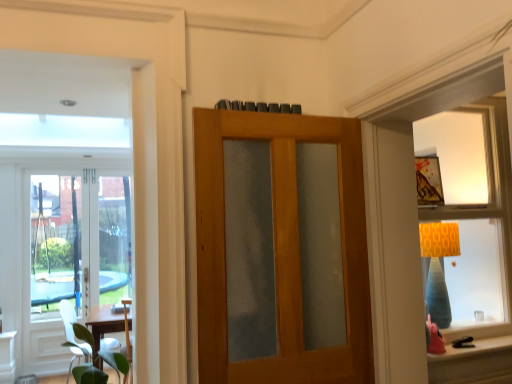
The height and width of the screenshot is (384, 512). I want to click on matte orange lampshade at upper right, so click(x=475, y=213).

Is white matte chair at lower left touching matte orange lampshade at lower right?

white matte chair at lower left and matte orange lampshade at lower right are not in contact.

From the image's perspective, which object appears higher, white matte chair at lower left or matte orange lampshade at lower right?

matte orange lampshade at lower right.

Between white matte chair at lower left and matte orange lampshade at lower right, which one is positioned behind?

Positioned behind is white matte chair at lower left.

Is wooden door with frosted glass at center, the first door viewed from the front, taller or shorter than clear glass door at left, arranged as the second door when viewed from the right?

In the image, wooden door with frosted glass at center, the first door viewed from the front, appears to be shorter than clear glass door at left, arranged as the second door when viewed from the right.

Is wooden door with frosted glass at center, the first door viewed from the front, turned away from clear glass door at left, which ranks as the 2th door in front-to-back order?

Absolutely, wooden door with frosted glass at center, the first door viewed from the front, is directed away from clear glass door at left, which ranks as the 2th door in front-to-back order.

Would you say wooden door with frosted glass at center, the first door viewed from the front, is inside or outside clear glass door at left, arranged as the second door when viewed from the right?

wooden door with frosted glass at center, the first door viewed from the front, cannot be found inside clear glass door at left, arranged as the second door when viewed from the right.

Would you consider wooden door with frosted glass at center, positioned as the 2th door in left-to-right order, to be distant from clear glass door at left, which ranks as the 2th door in front-to-back order?

Yes.

I want to click on chair behind the matte orange lampshade at upper right, so (72, 334).

Is point (65, 313) less distant than point (440, 123)?

No, it is behind (440, 123).

From the image's perspective, which object appears higher, white matte chair at lower left or matte orange lampshade at upper right?

matte orange lampshade at upper right.

Who is taller, matte orange lampshade at lower right or matte orange lampshade at upper right?

matte orange lampshade at upper right.

Which is nearer, (494, 348) or (483, 145)?

Point (494, 348) is positioned closer to the camera compared to point (483, 145).

From a real-world perspective, which is physically above, matte orange lampshade at lower right or matte orange lampshade at upper right?

matte orange lampshade at upper right is physically above.

Considering the sizes of objects matte orange lampshade at lower right and matte orange lampshade at upper right in the image provided, who is bigger, matte orange lampshade at lower right or matte orange lampshade at upper right?

With larger size is matte orange lampshade at upper right.

Looking at this image, considering the sizes of objects matte orange lampshade at lower right and clear glass door at left, which ranks as the 1th door in left-to-right order, in the image provided, who is thinner, matte orange lampshade at lower right or clear glass door at left, which ranks as the 1th door in left-to-right order,?

Thinner between the two is clear glass door at left, which ranks as the 1th door in left-to-right order.

Is matte orange lampshade at lower right looking in the opposite direction of clear glass door at left, which ranks as the 2th door in front-to-back order?

matte orange lampshade at lower right is not turned away from clear glass door at left, which ranks as the 2th door in front-to-back order.

From the image's perspective, which is below, matte orange lampshade at lower right or clear glass door at left, which ranks as the 1th door in left-to-right order?

matte orange lampshade at lower right.

Where is `the 2nd door to the left of the matte orange lampshade at lower right, counting from the anchor's position`? The image size is (512, 384). the 2nd door to the left of the matte orange lampshade at lower right, counting from the anchor's position is located at coordinates (73, 254).

Image resolution: width=512 pixels, height=384 pixels. Find the location of `door that is the 1st one when counting downward from the matte orange lampshade at upper right (from the image's perspective)`. door that is the 1st one when counting downward from the matte orange lampshade at upper right (from the image's perspective) is located at coordinates (281, 249).

Is matte orange lampshade at upper right beside wooden door with frosted glass at center, positioned as the 2th door in left-to-right order?

There is a gap between matte orange lampshade at upper right and wooden door with frosted glass at center, positioned as the 2th door in left-to-right order.

Between matte orange lampshade at upper right and wooden door with frosted glass at center, the first door viewed from the front, which one has less height?

wooden door with frosted glass at center, the first door viewed from the front.

Which object is more forward, matte orange lampshade at upper right or wooden door with frosted glass at center, positioned as the 2th door in left-to-right order?

Positioned in front is wooden door with frosted glass at center, positioned as the 2th door in left-to-right order.

Would you consider matte orange lampshade at upper right to be distant from clear glass door at left, which ranks as the 2th door in front-to-back order?

Yes, matte orange lampshade at upper right and clear glass door at left, which ranks as the 2th door in front-to-back order, are quite far apart.

Is matte orange lampshade at upper right facing away from clear glass door at left, the 1th door from the back?

matte orange lampshade at upper right is not turned away from clear glass door at left, the 1th door from the back.

Between point (449, 299) and point (45, 352), which one is positioned behind?

Point (45, 352)

Considering the sizes of objects matte orange lampshade at upper right and clear glass door at left, which ranks as the 1th door in left-to-right order, in the image provided, who is thinner, matte orange lampshade at upper right or clear glass door at left, which ranks as the 1th door in left-to-right order,?

clear glass door at left, which ranks as the 1th door in left-to-right order, is thinner.

Locate an element on the screen. chair located on the left of matte orange lampshade at lower right is located at coordinates (72, 334).

The image size is (512, 384). I want to click on door above the clear glass door at left, which ranks as the 1th door in left-to-right order (from the image's perspective), so click(281, 249).

Looking at the image, which one is located closer to matte orange lampshade at lower right, matte orange lampshade at upper right or clear glass door at left, which ranks as the 1th door in left-to-right order?

Based on the image, matte orange lampshade at upper right appears to be nearer to matte orange lampshade at lower right.

Which object lies further to the anchor point matte orange lampshade at upper right, white matte chair at lower left or wooden door with frosted glass at center, the first door positioned from the right?

The object further to matte orange lampshade at upper right is white matte chair at lower left.

Looking at the image, which one is located further to wooden door with frosted glass at center, positioned as the 2th door in left-to-right order, matte orange lampshade at upper right or matte orange lampshade at lower right?

matte orange lampshade at upper right lies further to wooden door with frosted glass at center, positioned as the 2th door in left-to-right order, than the other object.

From the image, which object appears to be nearer to matte orange lampshade at upper right, clear glass door at left, which ranks as the 2th door in front-to-back order, or white matte chair at lower left?

white matte chair at lower left lies closer to matte orange lampshade at upper right than the other object.

Looking at the image, which one is located closer to clear glass door at left, which ranks as the 1th door in left-to-right order, white matte chair at lower left or matte orange lampshade at lower right?

white matte chair at lower left.

Based on their spatial positions, is wooden door with frosted glass at center, positioned as the 2th door in left-to-right order, or clear glass door at left, the 1th door from the back, closer to matte orange lampshade at lower right?

wooden door with frosted glass at center, positioned as the 2th door in left-to-right order, lies closer to matte orange lampshade at lower right than the other object.

Considering their positions, is matte orange lampshade at lower right positioned further to matte orange lampshade at upper right than white matte chair at lower left?

The object further to matte orange lampshade at upper right is white matte chair at lower left.

Considering their positions, is white matte chair at lower left positioned further to wooden door with frosted glass at center, the first door positioned from the right, than clear glass door at left, arranged as the second door when viewed from the right?

clear glass door at left, arranged as the second door when viewed from the right, is positioned further to the anchor wooden door with frosted glass at center, the first door positioned from the right.

The height and width of the screenshot is (384, 512). I want to click on door between white matte chair at lower left and matte orange lampshade at upper right from left to right, so click(x=281, y=249).

I want to click on door between clear glass door at left, the 1th door from the back, and matte orange lampshade at upper right from left to right, so click(x=281, y=249).

This screenshot has height=384, width=512. Identify the location of door situated between clear glass door at left, which ranks as the 1th door in left-to-right order, and matte orange lampshade at lower right from left to right. (281, 249).

At what (x,y) coordinates should I click in order to perform the action: click on window situated between white matte chair at lower left and matte orange lampshade at lower right from left to right. Please return your answer as a coordinate pair (x, y). This screenshot has height=384, width=512. Looking at the image, I should click on (475, 213).